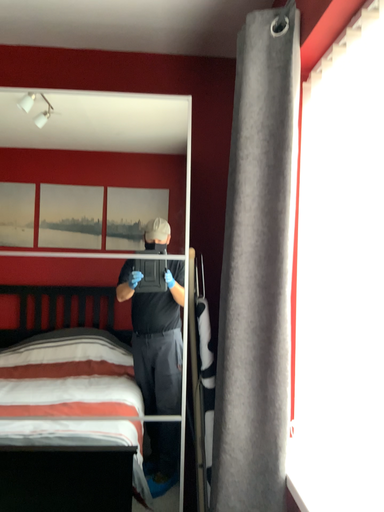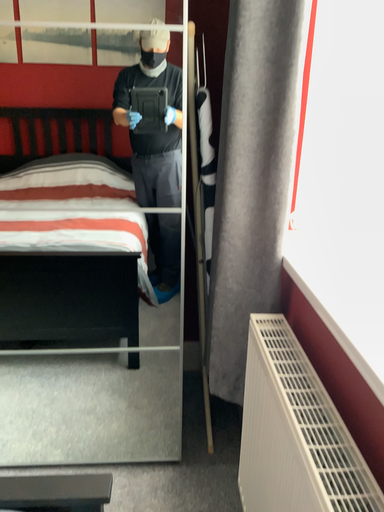
Question: Which way did the camera rotate in the video?

Choices:
 (A) rotated downward
 (B) rotated upward

Answer: (A)